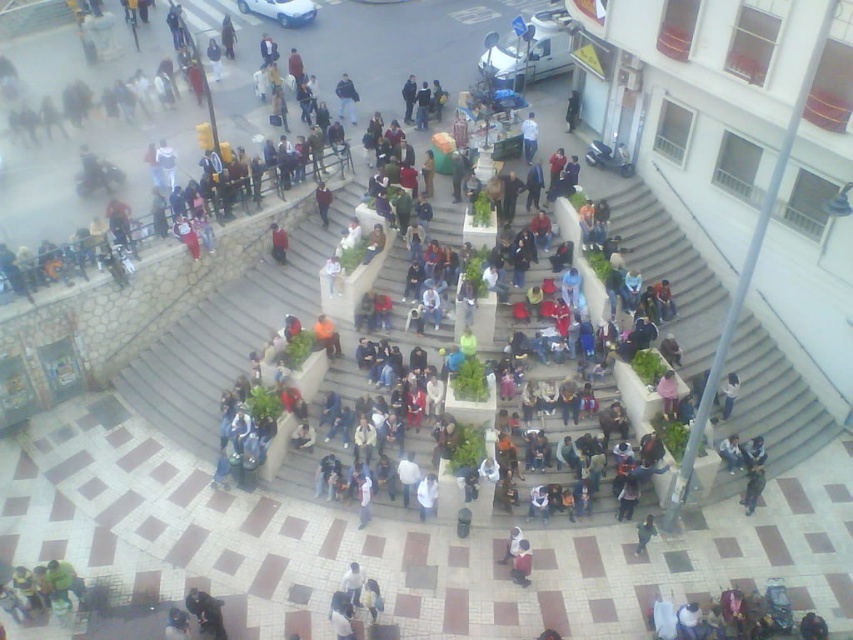
Question: Can you confirm if white concrete stairs at center is positioned above dark blue sweater at center?

Choices:
 (A) yes
 (B) no

Answer: (B)

Question: Which object appears farthest from the camera in this image?

Choices:
 (A) dark blue sweater at center
 (B) white concrete stairs at center

Answer: (A)

Question: Which of the following is the farthest from the observer?

Choices:
 (A) (318, 184)
 (B) (747, 346)

Answer: (A)

Question: Can you confirm if white concrete stairs at center is bigger than dark blue sweater at center?

Choices:
 (A) yes
 (B) no

Answer: (A)

Question: Does white concrete stairs at center have a smaller size compared to dark blue sweater at center?

Choices:
 (A) yes
 (B) no

Answer: (B)